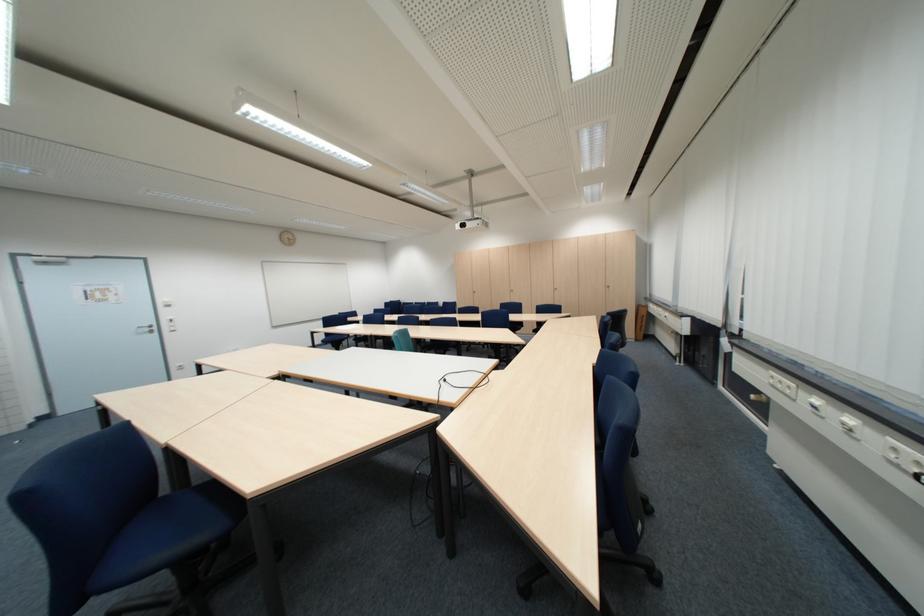
Where would you sitting on the blue chair sitting surface? Please return your answer as a coordinate pair (x, y).

(174, 525)